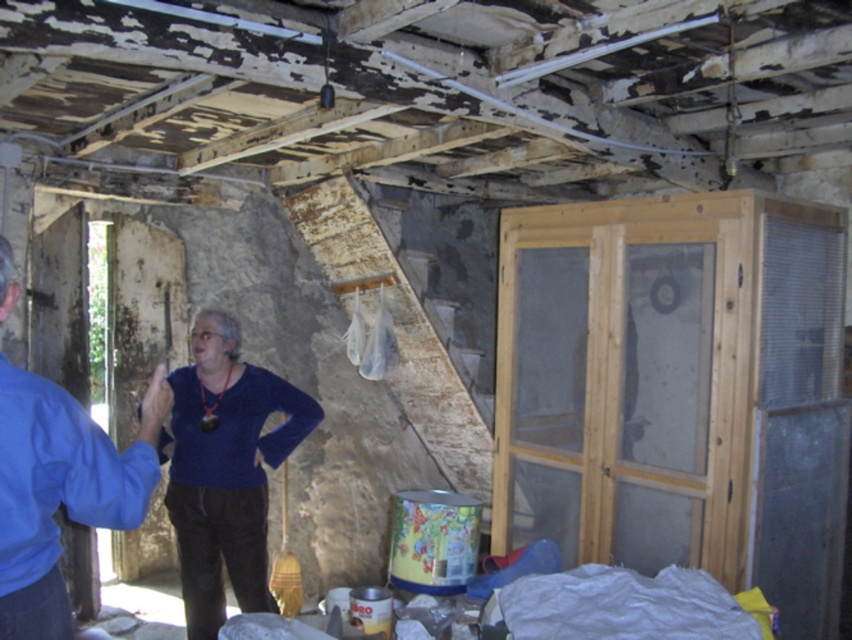
Question: Does blue velvet sweater at center have a greater width compared to blue fabric shirt at left?

Choices:
 (A) no
 (B) yes

Answer: (B)

Question: Does blue velvet sweater at center appear over blue fabric shirt at left?

Choices:
 (A) no
 (B) yes

Answer: (A)

Question: Is blue velvet sweater at center positioned at the back of blue fabric shirt at left?

Choices:
 (A) no
 (B) yes

Answer: (B)